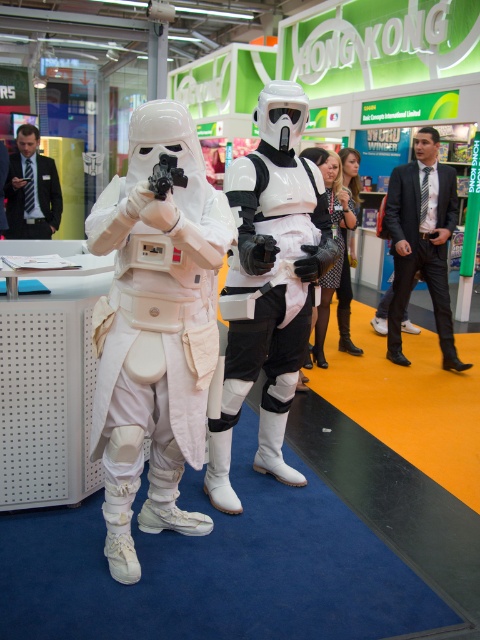
Does white matte costume at center appear on the left side of dark blue suit at left?

No, white matte costume at center is not to the left of dark blue suit at left.

Who is more forward, [181,212] or [37,228]?

Positioned in front is point [181,212].

In order to click on white matte costume at center in this screenshot , I will do `click(155, 326)`.

Is white matte costume at center to the right of black suit at right from the viewer's perspective?

In fact, white matte costume at center is to the left of black suit at right.

Between white matte costume at center and black suit at right, which one is positioned higher?

black suit at right is higher up.

The image size is (480, 640). Find the location of `white matte costume at center`. white matte costume at center is located at coordinates [x=155, y=326].

Based on the photo, does white matte stormtrooper at center have a greater height compared to dark blue suit at left?

Correct, white matte stormtrooper at center is much taller as dark blue suit at left.

Consider the image. Is white matte stormtrooper at center to the left of dark blue suit at left from the viewer's perspective?

No, white matte stormtrooper at center is not to the left of dark blue suit at left.

Which is behind, point (265, 384) or point (23, 145)?

Point (23, 145)

Identify the location of white matte stormtrooper at center. Image resolution: width=480 pixels, height=640 pixels. (268, 284).